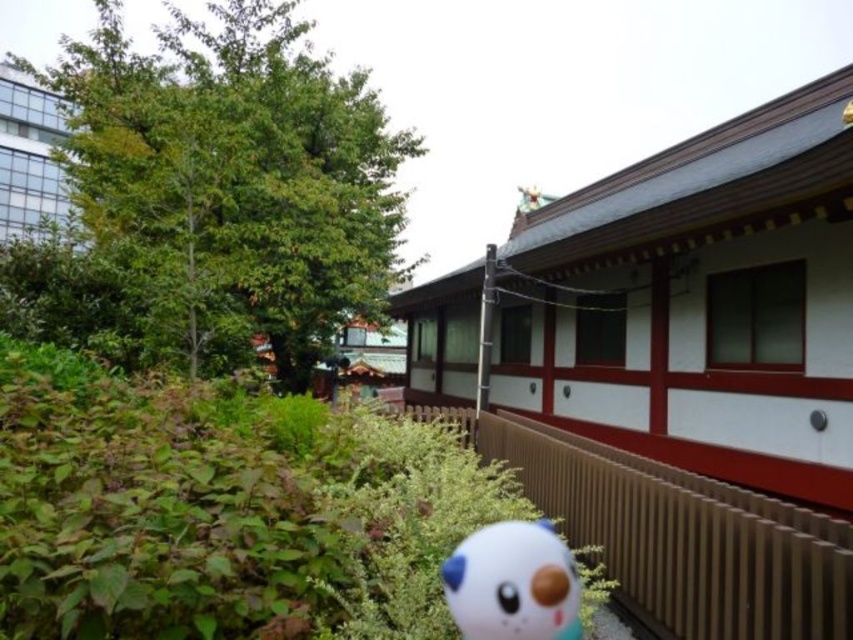
You are a visitor at this Japanese garden and want to sit down on the white glossy plush at lower center. However, there is a brown wooden rail at lower right nearby. Considering their heights, which object is taller and might block your view if you sit there?

The brown wooden rail at lower right is taller than the white glossy plush at lower center, so it might block your view if you sit on the white glossy plush at lower center.

You are standing at the entrance of the traditional Japanese building on the right. You want to walk towards the dense greenery on the left. Is the point represented by point (x=677, y=534) in your path?

The point represented by point (x=677, y=534) is the brown wooden rail at lower right, which is located at the lower right of the scene. Since you are moving from the building on the right towards the greenery on the left, the brown wooden rail at lower right would not be in your path.